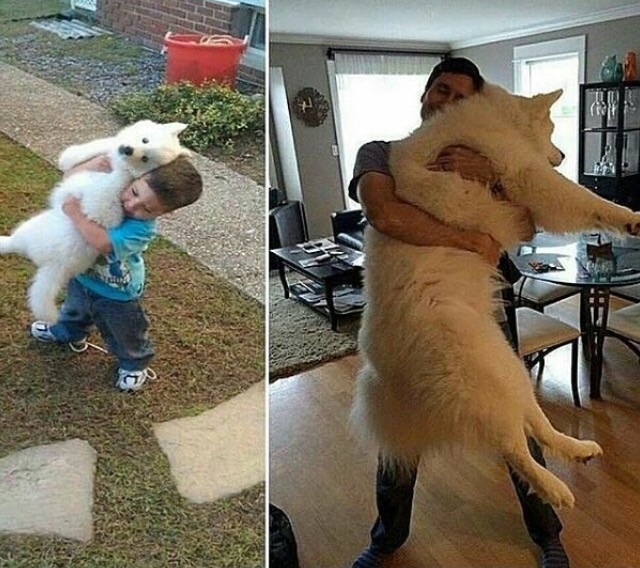
Where is `dining table`? Image resolution: width=640 pixels, height=568 pixels. dining table is located at coordinates (569, 272).